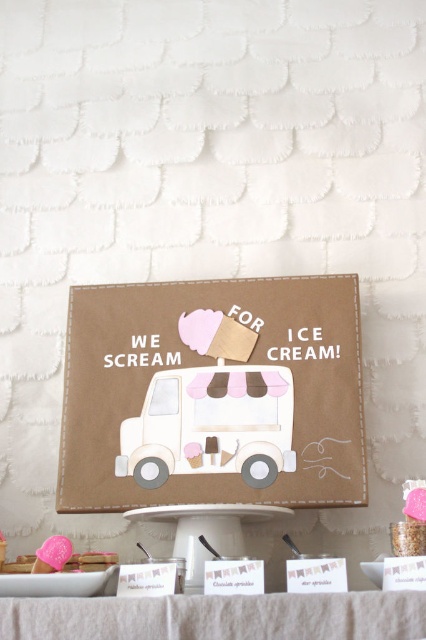
Does point (304, 280) come farther from viewer compared to point (106, 554)?

Yes, point (304, 280) is farther from viewer.

Between point (291, 328) and point (40, 557), which one is positioned behind?

Point (291, 328)

The image size is (426, 640). What are the coordinates of `brown paper ice cream truck at center` in the screenshot? It's located at (213, 394).

The image size is (426, 640). I want to click on brown paper ice cream truck at center, so click(x=213, y=394).

Does white cardboard ice cream truck at center appear under pink frosted cookie at center?

No.

Can you confirm if white cardboard ice cream truck at center is bigger than pink frosted cookie at center?

Correct, white cardboard ice cream truck at center is larger in size than pink frosted cookie at center.

Between point (206, 467) and point (57, 536), which one is positioned behind?

Point (57, 536)

I want to click on white cardboard ice cream truck at center, so click(x=210, y=426).

Looking at this image, which is below, white linen tablecloth at lower center or pink frosted cookie at center?

Positioned lower is white linen tablecloth at lower center.

Identify the location of white linen tablecloth at lower center. This screenshot has height=640, width=426. (218, 616).